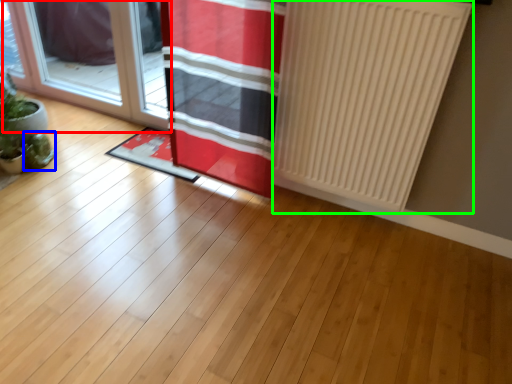
Question: Which object is the closest to the door (highlighted by a red box)? Choose among these: plant (highlighted by a blue box) or radiator (highlighted by a green box).

Choices:
 (A) plant
 (B) radiator

Answer: (A)